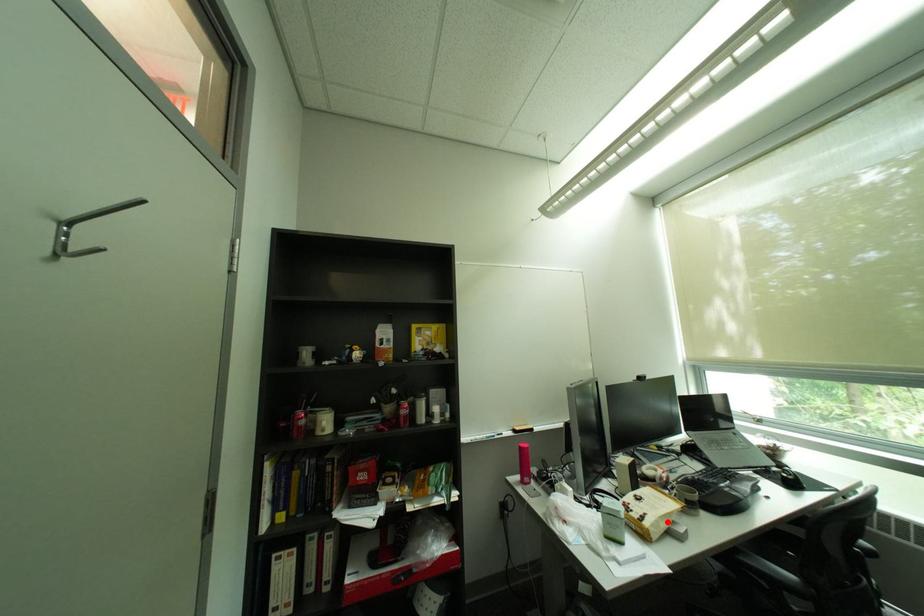
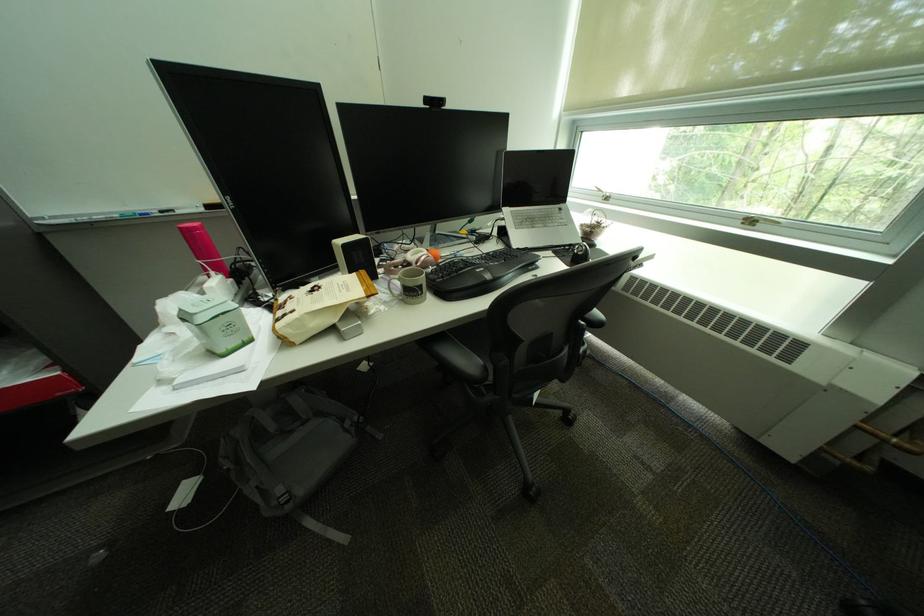
The point at the highlighted location is marked in the first image. Where is the corresponding point in the second image?

(309, 321)